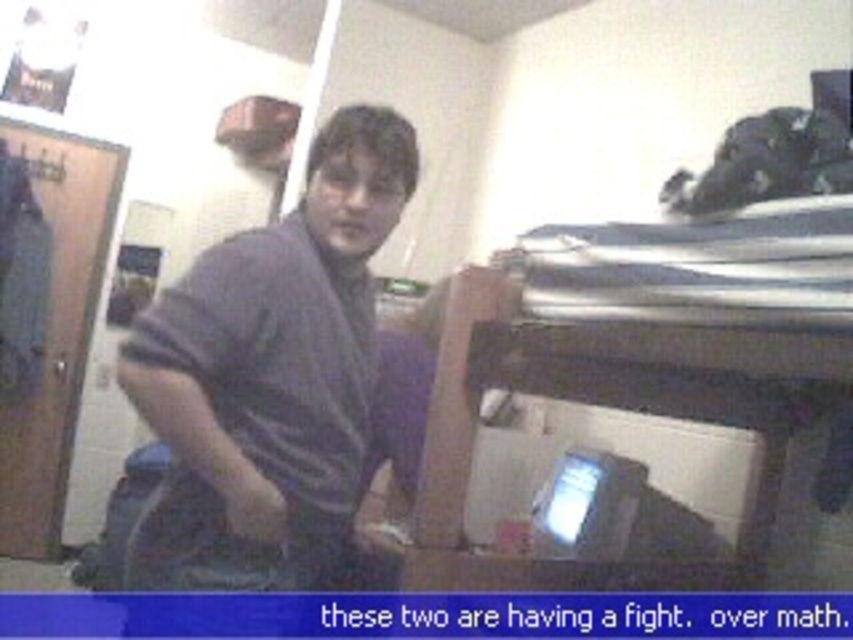
Question: Is metallic silver bunk bed at right wider than dark gray cotton shirt at center?

Choices:
 (A) no
 (B) yes

Answer: (B)

Question: Among these objects, which one is nearest to the camera?

Choices:
 (A) metallic silver bunk bed at right
 (B) dark gray cotton shirt at center

Answer: (A)

Question: Can you confirm if metallic silver bunk bed at right is positioned to the left of dark gray cotton shirt at center?

Choices:
 (A) no
 (B) yes

Answer: (A)

Question: Can you confirm if metallic silver bunk bed at right is positioned below dark gray cotton shirt at center?

Choices:
 (A) no
 (B) yes

Answer: (B)

Question: Which of the following is the farthest from the observer?

Choices:
 (A) metallic silver bunk bed at right
 (B) dark gray cotton shirt at center

Answer: (B)